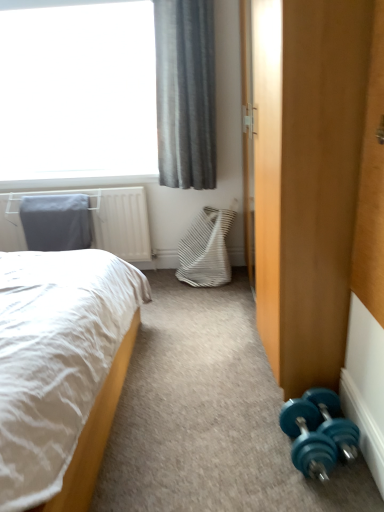
Question: From the image's perspective, is teal rubber dumbbell at lower right, which appears as the second dumbbell when viewed from the left, located above gray fabric pillow at upper left?

Choices:
 (A) yes
 (B) no

Answer: (B)

Question: From the image's perspective, does teal rubber dumbbell at lower right, arranged as the first dumbbell when viewed from the right, appear lower than gray fabric pillow at upper left?

Choices:
 (A) no
 (B) yes

Answer: (B)

Question: Can you confirm if teal rubber dumbbell at lower right, which appears as the second dumbbell when viewed from the left, is positioned to the right of gray fabric pillow at upper left?

Choices:
 (A) yes
 (B) no

Answer: (A)

Question: Is gray fabric pillow at upper left inside teal rubber dumbbell at lower right, which appears as the second dumbbell when viewed from the left?

Choices:
 (A) yes
 (B) no

Answer: (B)

Question: Does teal rubber dumbbell at lower right, arranged as the first dumbbell when viewed from the right, have a greater height compared to gray fabric pillow at upper left?

Choices:
 (A) no
 (B) yes

Answer: (A)

Question: Can we say teal rubber dumbbell at lower right, which appears as the second dumbbell when viewed from the left, lies outside gray fabric pillow at upper left?

Choices:
 (A) no
 (B) yes

Answer: (B)

Question: Can we say white soft bed at left lies outside gray fabric pillow at upper left?

Choices:
 (A) yes
 (B) no

Answer: (A)

Question: From a real-world perspective, is white soft bed at left beneath gray fabric pillow at upper left?

Choices:
 (A) yes
 (B) no

Answer: (A)

Question: Does white soft bed at left lie in front of gray fabric pillow at upper left?

Choices:
 (A) no
 (B) yes

Answer: (B)

Question: Considering the relative sizes of white soft bed at left and gray fabric pillow at upper left in the image provided, is white soft bed at left thinner than gray fabric pillow at upper left?

Choices:
 (A) yes
 (B) no

Answer: (B)

Question: Does white soft bed at left lie behind gray fabric pillow at upper left?

Choices:
 (A) yes
 (B) no

Answer: (B)

Question: From the image's perspective, is white soft bed at left on gray fabric pillow at upper left?

Choices:
 (A) no
 (B) yes

Answer: (A)

Question: Is teal rubber dumbbell at lower right, which appears as the second dumbbell when viewed from the left, located within gray fabric curtain at upper left?

Choices:
 (A) no
 (B) yes

Answer: (A)